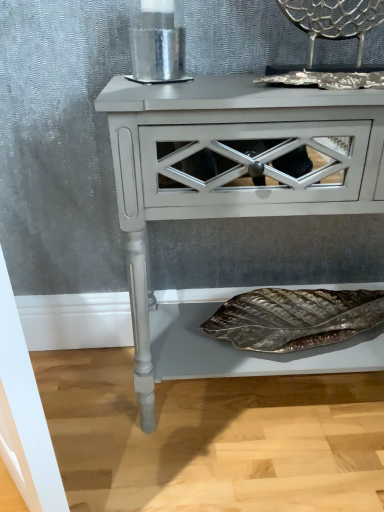
Question: Does matte white nightstand at center come behind metallic silver chair at upper right?

Choices:
 (A) no
 (B) yes

Answer: (A)

Question: Is matte white nightstand at center to the left of metallic silver chair at upper right from the viewer's perspective?

Choices:
 (A) yes
 (B) no

Answer: (A)

Question: Is matte white nightstand at center in contact with metallic silver chair at upper right?

Choices:
 (A) yes
 (B) no

Answer: (B)

Question: Is matte white nightstand at center in front of metallic silver chair at upper right?

Choices:
 (A) yes
 (B) no

Answer: (A)

Question: Is matte white nightstand at center thinner than metallic silver chair at upper right?

Choices:
 (A) yes
 (B) no

Answer: (B)

Question: Does matte white nightstand at center have a greater height compared to metallic silver chair at upper right?

Choices:
 (A) yes
 (B) no

Answer: (A)

Question: Does metallic silver chair at upper right have a smaller size compared to matte white nightstand at center?

Choices:
 (A) yes
 (B) no

Answer: (A)

Question: Would you say metallic silver chair at upper right is outside matte white nightstand at center?

Choices:
 (A) no
 (B) yes

Answer: (B)

Question: From the image's perspective, is metallic silver chair at upper right beneath matte white nightstand at center?

Choices:
 (A) yes
 (B) no

Answer: (B)

Question: Considering the relative sizes of metallic silver chair at upper right and matte white nightstand at center in the image provided, is metallic silver chair at upper right shorter than matte white nightstand at center?

Choices:
 (A) no
 (B) yes

Answer: (B)

Question: Is there a large distance between metallic silver chair at upper right and matte white nightstand at center?

Choices:
 (A) yes
 (B) no

Answer: (B)

Question: Is metallic silver chair at upper right further to the viewer compared to matte white nightstand at center?

Choices:
 (A) no
 (B) yes

Answer: (B)

Question: From a real-world perspective, is matte white nightstand at center physically located above or below metallic silver chair at upper right?

Choices:
 (A) above
 (B) below

Answer: (B)